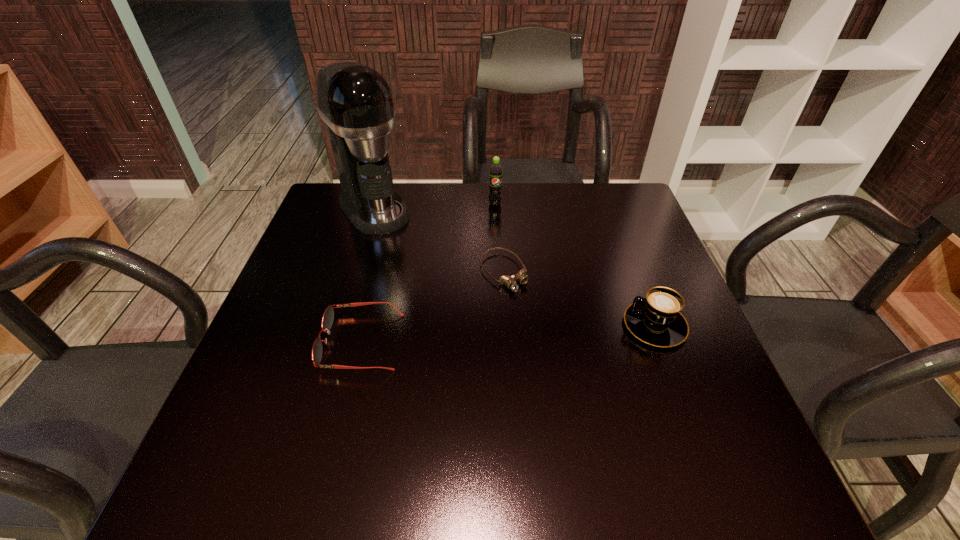
The width and height of the screenshot is (960, 540). In order to click on spectacles in this screenshot , I will do `click(327, 320)`.

Where is `the third shortest object`? This screenshot has height=540, width=960. the third shortest object is located at coordinates (656, 320).

Identify the location of the rightmost object. (656, 320).

Image resolution: width=960 pixels, height=540 pixels. In order to click on the tallest object in this screenshot , I will do `click(355, 101)`.

Identify the location of the shortest object. (509, 281).

Where is `goggles`? Image resolution: width=960 pixels, height=540 pixels. goggles is located at coordinates (509, 281).

Locate an element on the screen. Image resolution: width=960 pixels, height=540 pixels. soda is located at coordinates pos(495,185).

Where is `vacant region located 0.050m on the lenses of the fourth tallest object`? This screenshot has width=960, height=540. vacant region located 0.050m on the lenses of the fourth tallest object is located at coordinates pos(298,342).

At what (x,y) coordinates should I click in order to perform the action: click on vacant area located on the lenses of the fourth tallest object. Please return your answer as a coordinate pair (x, y). The height and width of the screenshot is (540, 960). Looking at the image, I should click on (282, 342).

Locate an element on the screen. free space located on the lenses of the fourth tallest object is located at coordinates (282, 342).